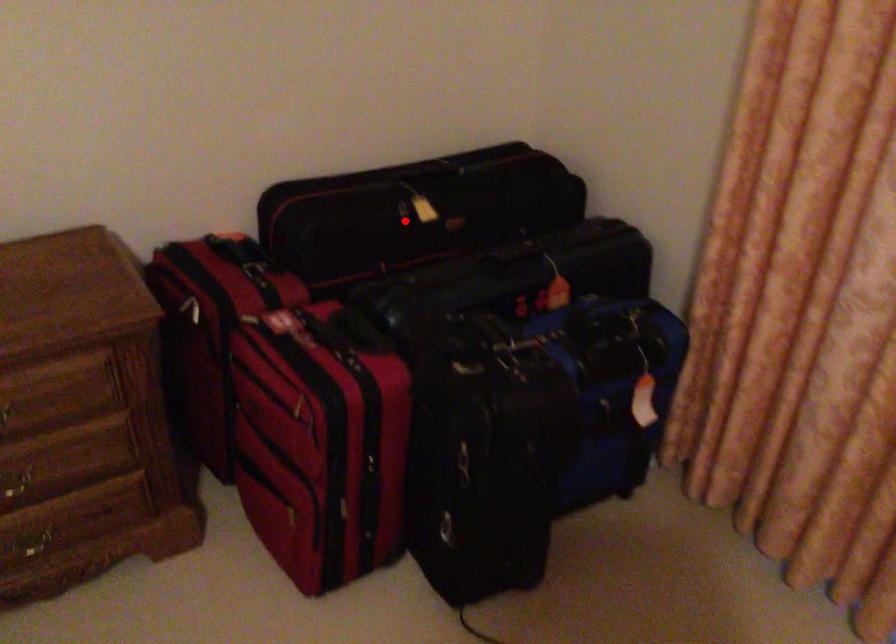
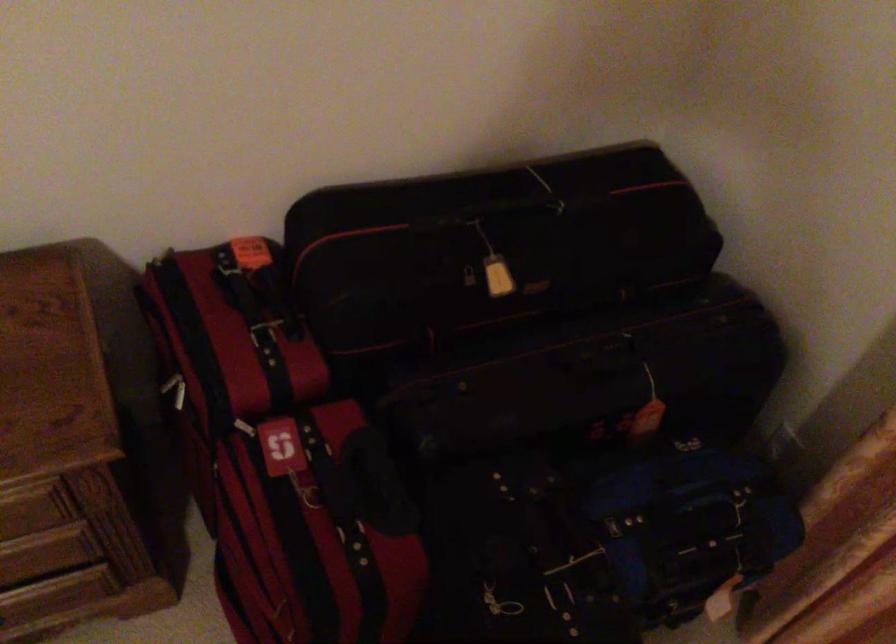
Question: I am providing you with two images of the same scene from different viewpoints. A red point is shown in image1. For the corresponding object point in image2, is it positioned nearer or farther from the camera?

Choices:
 (A) Nearer
 (B) Farther

Answer: (A)